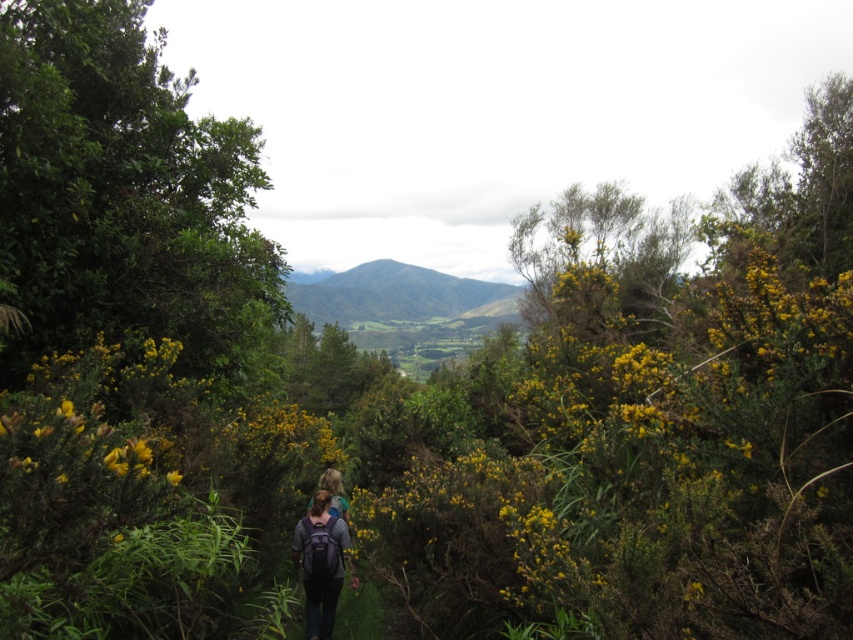
Question: Is green leafy bush at upper left below green grassy hillside at center?

Choices:
 (A) yes
 (B) no

Answer: (A)

Question: Is matte purple backpack at center below yellow matte flower at center?

Choices:
 (A) no
 (B) yes

Answer: (B)

Question: Which point appears farthest from the camera in this image?

Choices:
 (A) (334, 564)
 (B) (172, 474)
 (C) (49, 38)

Answer: (C)

Question: Can you confirm if green leafy bush at upper left is positioned to the left of yellow matte flower at center?

Choices:
 (A) yes
 (B) no

Answer: (A)

Question: Estimate the real-world distances between objects in this image. Which object is farther from the green grassy hillside at center?

Choices:
 (A) yellow matte flower at center
 (B) green leafy bush at upper left

Answer: (A)

Question: Considering the real-world distances, which object is closest to the matte purple backpack at center?

Choices:
 (A) yellow matte flower at center
 (B) green grassy hillside at center

Answer: (A)